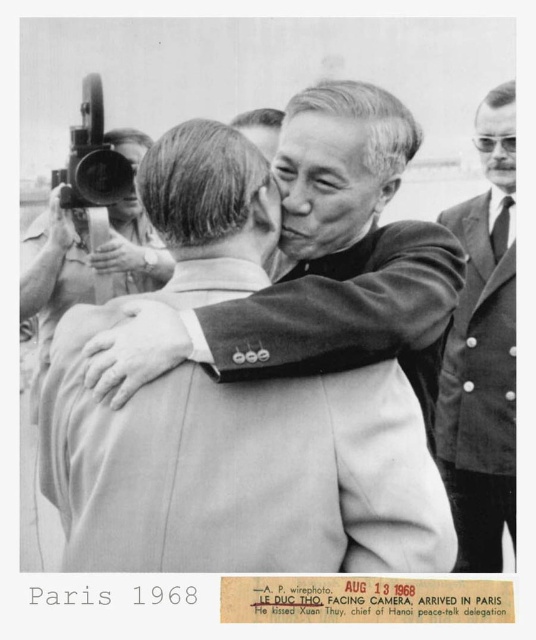
In the scene shown: Based on the scene described, which object is bigger between the smooth suit at center and the smooth suit jacket at right?

The smooth suit at center is larger in size compared to the smooth suit jacket at right.

Based on the image described, which object is wider between the smooth suit at center and the smooth suit jacket at right?

The smooth suit at center is wider than the smooth suit jacket at right according to the description.